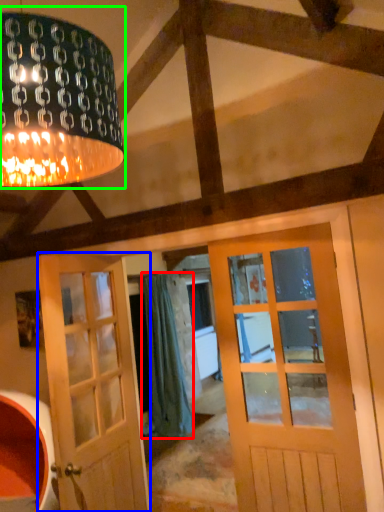
Question: Based on their relative distances, which object is nearer to curtain (highlighted by a red box)? Choose from door (highlighted by a blue box) and lamp (highlighted by a green box).

Choices:
 (A) door
 (B) lamp

Answer: (A)